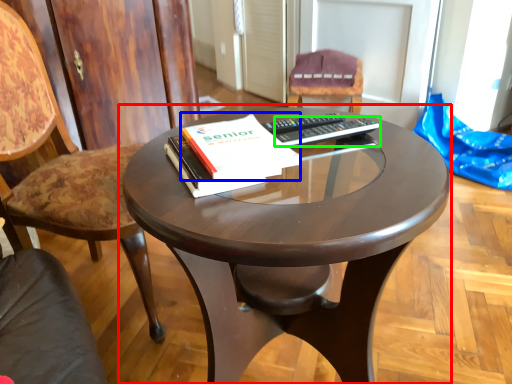
Question: Which is farther away from coffee table (highlighted by a red box)? paperback book (highlighted by a blue box) or remote (highlighted by a green box)?

Choices:
 (A) paperback book
 (B) remote

Answer: (B)